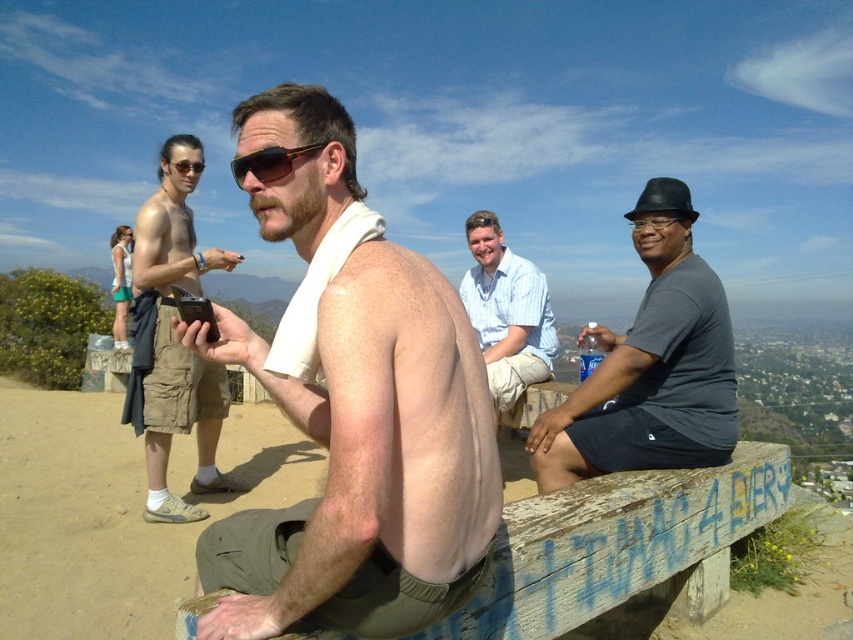
Between shiny skin torso at center and dark gray t-shirt at right, which one is positioned higher?

shiny skin torso at center

Which of these two, shiny skin torso at center or dark gray t-shirt at right, stands shorter?

shiny skin torso at center

Is point (245, 625) farther from viewer compared to point (698, 312)?

No, (245, 625) is closer to viewer.

Locate an element on the screen. The image size is (853, 640). shiny skin torso at center is located at coordinates (364, 461).

Between shiny skin torso at center and tan cargo shorts at left, which one has more height?

Standing taller between the two is shiny skin torso at center.

Can you confirm if shiny skin torso at center is positioned to the right of tan cargo shorts at left?

Correct, you'll find shiny skin torso at center to the right of tan cargo shorts at left.

Consider the image. Who is more forward, (381, 544) or (164, 179)?

Positioned in front is point (381, 544).

Where is `shiny skin torso at center`? This screenshot has height=640, width=853. shiny skin torso at center is located at coordinates (364, 461).

Between point (625, 465) and point (550, 365), which one is positioned in front?

Point (625, 465) is in front.

Which is above, dark gray t-shirt at right or light blue striped shirt at center?

Positioned higher is light blue striped shirt at center.

This screenshot has height=640, width=853. What are the coordinates of `dark gray t-shirt at right` in the screenshot? It's located at pyautogui.click(x=650, y=365).